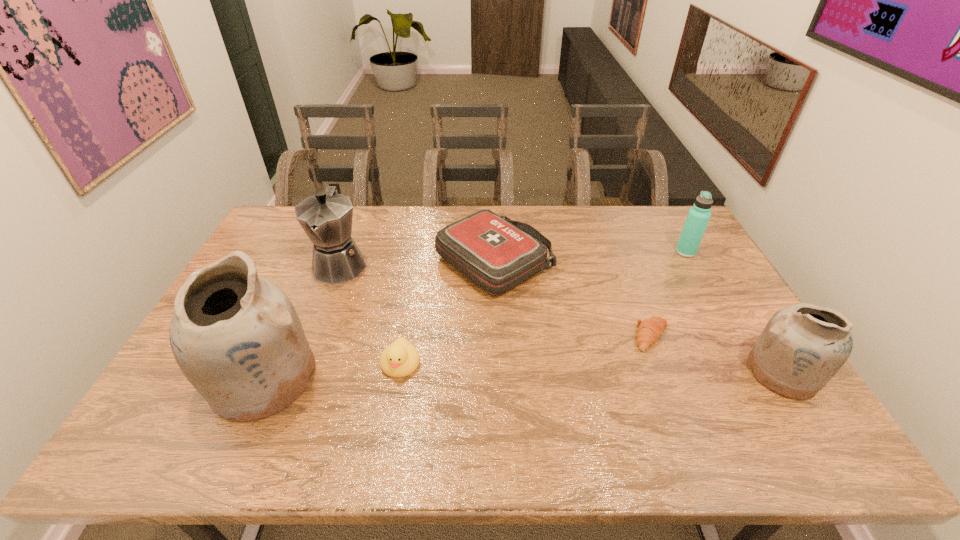
Where is `the tallest object`? the tallest object is located at coordinates (237, 338).

The height and width of the screenshot is (540, 960). Find the location of `the taller pottery`. the taller pottery is located at coordinates (237, 338).

Find the location of a particular element. Image resolution: width=960 pixels, height=540 pixels. the right pottery is located at coordinates (803, 346).

Find the location of a particular element. Image resolution: width=960 pixels, height=540 pixels. thermos bottle is located at coordinates (698, 216).

Find the location of a particular element. the fourth object from left to right is located at coordinates (496, 254).

Where is `the fifth tallest object`? the fifth tallest object is located at coordinates (496, 254).

This screenshot has height=540, width=960. I want to click on the fifth object from left to right, so click(649, 330).

Identify the location of crescent roll. This screenshot has height=540, width=960. (649, 330).

I want to click on the sixth shortest object, so click(x=326, y=217).

The height and width of the screenshot is (540, 960). I want to click on the sixth tallest object, so click(400, 359).